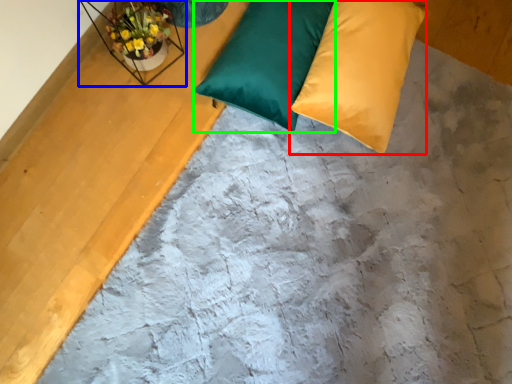
Question: Which object is the closest to the pillow (highlighted by a red box)? Choose among these: window sill (highlighted by a blue box) or pillow (highlighted by a green box).

Choices:
 (A) window sill
 (B) pillow

Answer: (B)